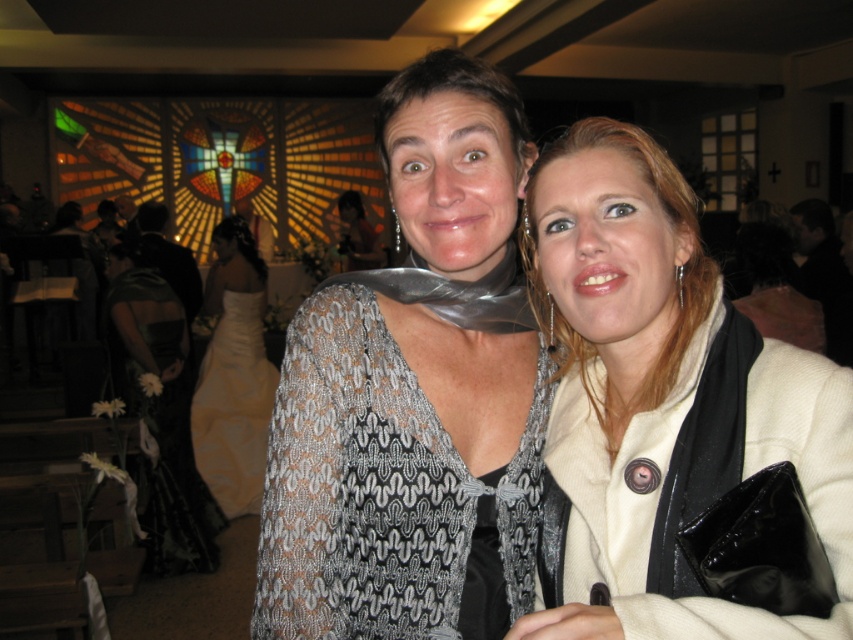
Between point (635, 632) and point (218, 317), which one is positioned in front?

Point (635, 632) is more forward.

This screenshot has height=640, width=853. What are the coordinates of `white matte coat at center` in the screenshot? It's located at (663, 397).

Between point (724, 328) and point (219, 353), which one is positioned in front?

Point (724, 328) is in front.

Identify the location of white matte coat at center. This screenshot has width=853, height=640. (663, 397).

Does patterned fabric dress at center have a lesser height compared to black satin dress at left?

Indeed, patterned fabric dress at center has a lesser height compared to black satin dress at left.

Is point (260, 609) positioned behind point (181, 529)?

No, (260, 609) is in front of (181, 529).

Identify the location of patterned fabric dress at center. Image resolution: width=853 pixels, height=640 pixels. (378, 488).

Does white matte coat at center appear under matte silver scarf at center?

Correct, white matte coat at center is located below matte silver scarf at center.

Is white matte coat at center positioned in front of matte silver scarf at center?

Yes, white matte coat at center is closer to the viewer.

Is point (665, 397) positioned before point (343, 211)?

Yes.

What are the coordinates of `white matte coat at center` in the screenshot? It's located at (663, 397).